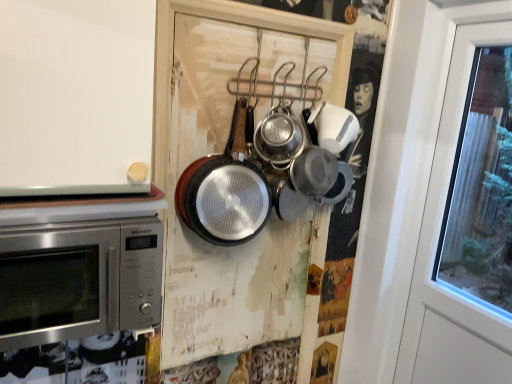
Question: Would you say silver textured frying pan at center, placed as the 2th frying pan when sorted from left to right, is inside or outside black textured frying pan at center, acting as the first frying pan starting from the left?

Choices:
 (A) outside
 (B) inside

Answer: (A)

Question: Looking at their shapes, would you say silver textured frying pan at center, the 1th frying pan when ordered from right to left, is wider or thinner than black textured frying pan at center, acting as the first frying pan starting from the left?

Choices:
 (A) wide
 (B) thin

Answer: (A)

Question: Which is farther from the silver textured frying pan at center, the 1th frying pan when ordered from right to left?

Choices:
 (A) stainless steel microwave at left
 (B) black textured frying pan at center, which ranks as the second frying pan in right-to-left order

Answer: (A)

Question: Estimate the real-world distances between objects in this image. Which object is farther from the stainless steel microwave at left?

Choices:
 (A) silver textured frying pan at center, placed as the 2th frying pan when sorted from left to right
 (B) black textured frying pan at center, acting as the first frying pan starting from the left

Answer: (A)